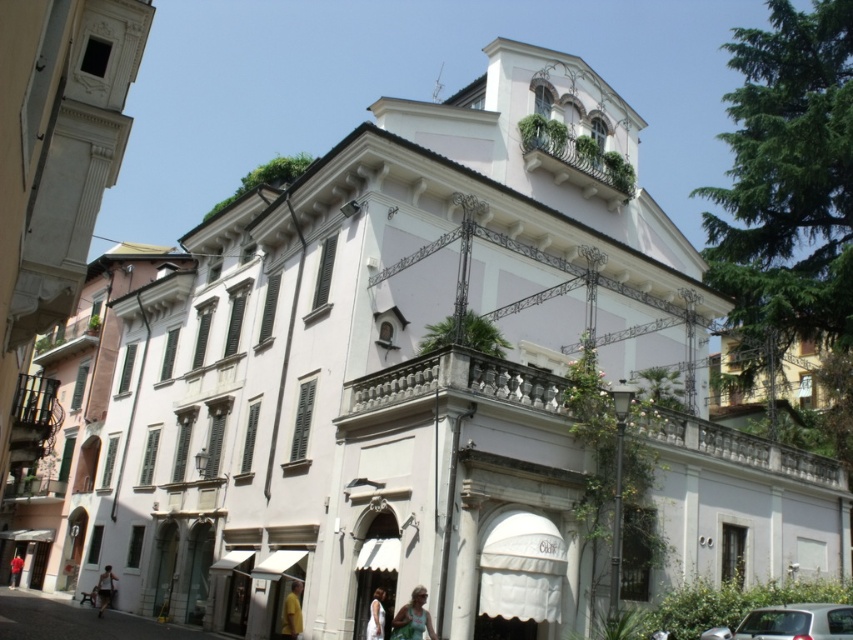
Is yellow fabric shirt at lower center smaller than red fabric person at center?

Yes, yellow fabric shirt at lower center is smaller than red fabric person at center.

Does point (297, 592) come closer to viewer compared to point (16, 582)?

Yes, point (297, 592) is closer to viewer.

The image size is (853, 640). I want to click on yellow fabric shirt at lower center, so click(x=292, y=612).

Does light brown hair at lower center appear under light brown fabric dress at lower center?

No, light brown hair at lower center is not below light brown fabric dress at lower center.

Which of these two, light brown hair at lower center or light brown fabric dress at lower center, stands taller?

light brown hair at lower center is taller.

Does point (415, 593) come behind point (381, 634)?

That is False.

Where is `light brown hair at lower center`? light brown hair at lower center is located at coordinates (413, 618).

Does light brown hair at lower center have a greater height compared to yellow fabric shirt at lower center?

No, light brown hair at lower center is not taller than yellow fabric shirt at lower center.

Is light brown hair at lower center thinner than yellow fabric shirt at lower center?

No, light brown hair at lower center is not thinner than yellow fabric shirt at lower center.

The image size is (853, 640). What do you see at coordinates (413, 618) in the screenshot? I see `light brown hair at lower center` at bounding box center [413, 618].

The image size is (853, 640). In order to click on light brown hair at lower center in this screenshot , I will do `click(413, 618)`.